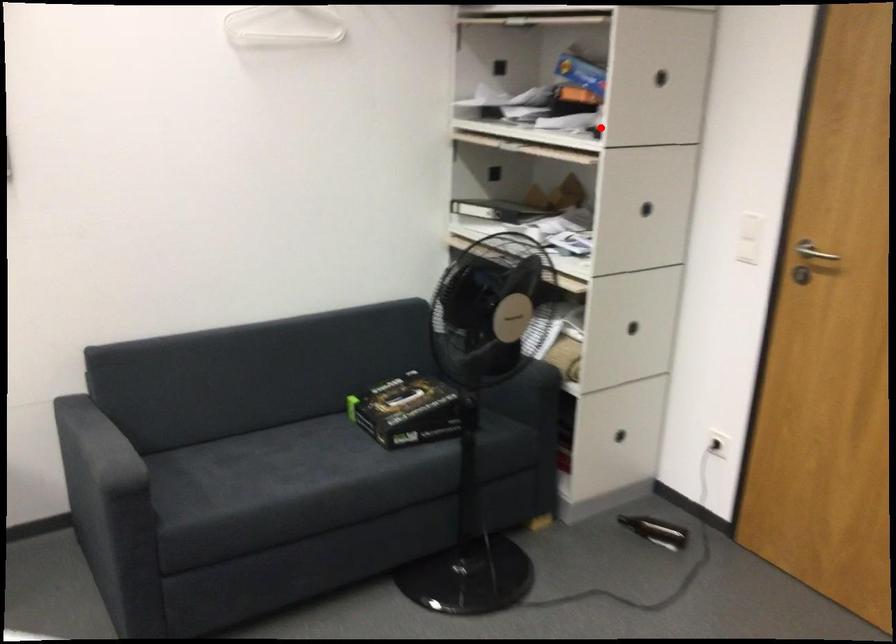
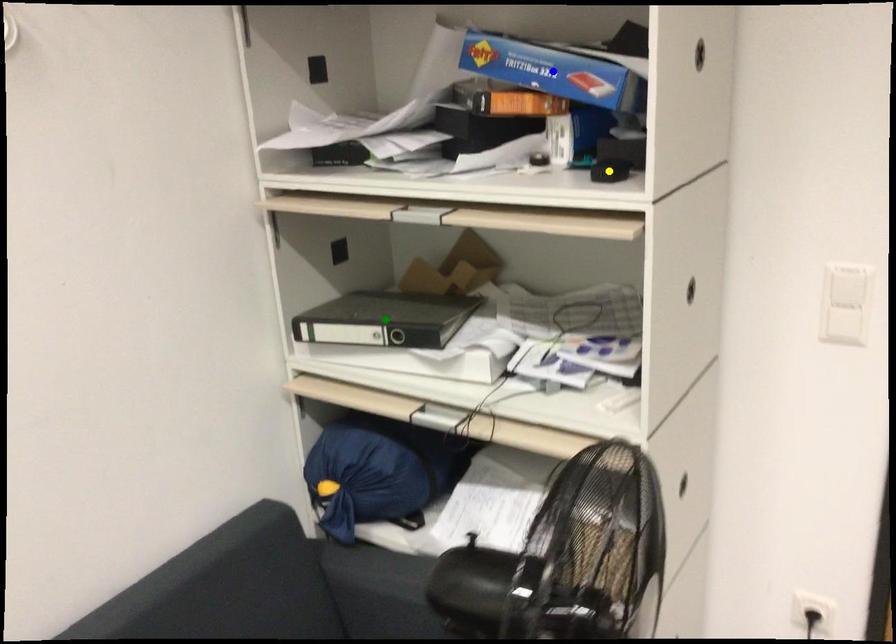
Question: I am providing you with two images of the same scene from different viewpoints. A red point is marked on the first image. You are given multiple points on the second image. Which point in image 2 is actually the same real-world point as the red point in image 1?

Choices:
 (A) green point
 (B) yellow point
 (C) blue point

Answer: (B)